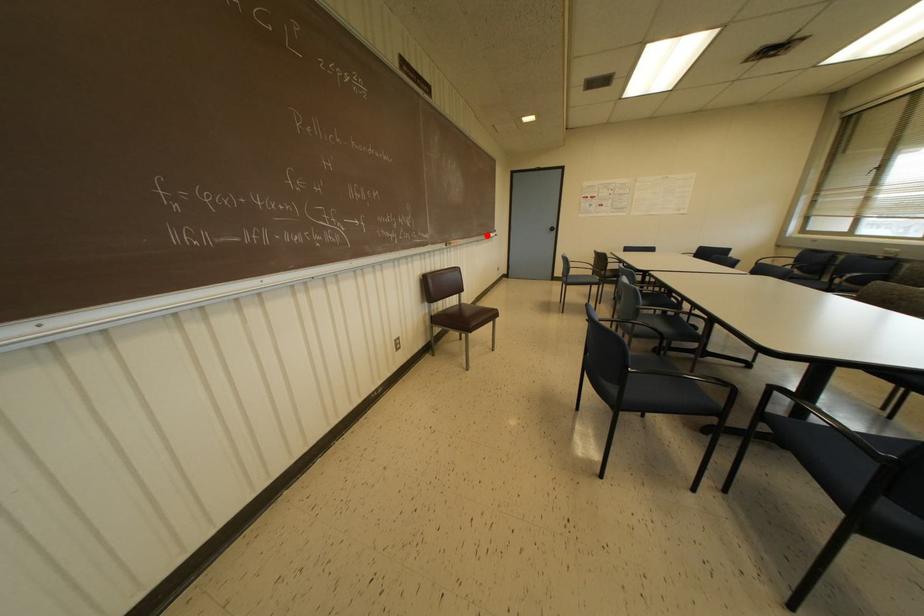
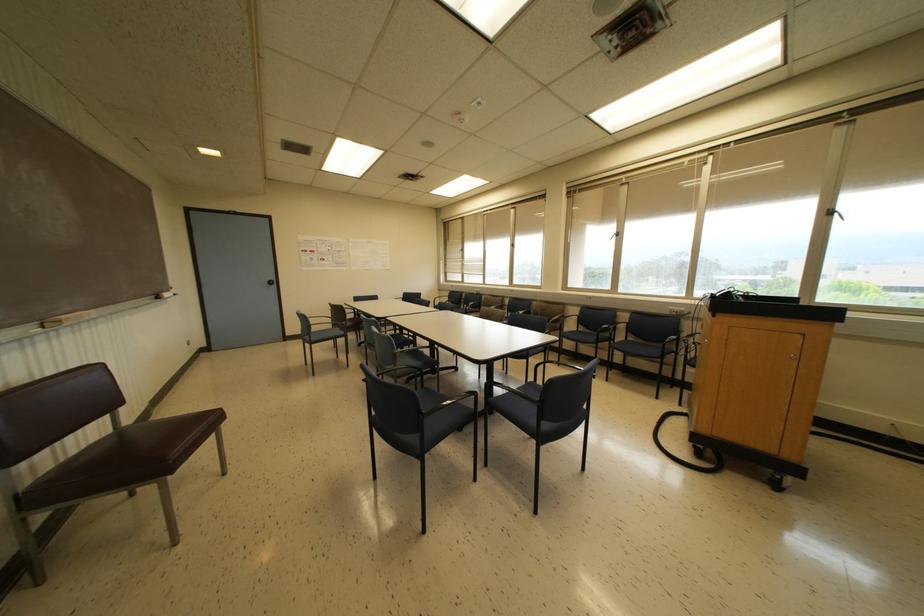
Question: I am providing you with two images of the same scene from different viewpoints. In image1, a red point is highlighted. Considering the same 3D point in image2, which of the following is correct?

Choices:
 (A) It is closer
 (B) It is farther

Answer: (B)